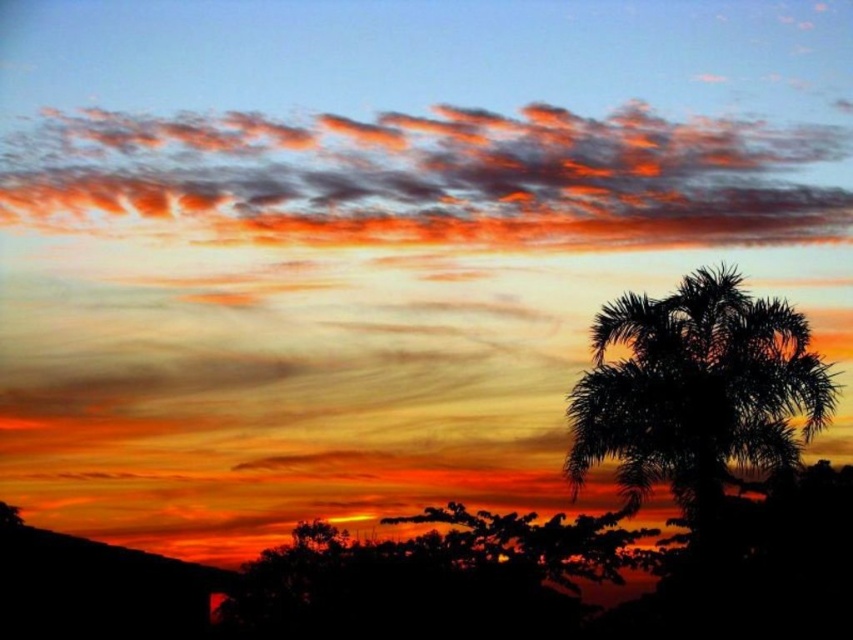
Question: Can you confirm if glowing orange clouds at upper center is positioned to the left of silhouette palm tree at right?

Choices:
 (A) yes
 (B) no

Answer: (A)

Question: Can you confirm if glowing orange clouds at upper center is bigger than silhouette palm tree at right?

Choices:
 (A) no
 (B) yes

Answer: (A)

Question: In this image, where is glowing orange clouds at upper center located relative to silhouette palm tree at right?

Choices:
 (A) left
 (B) right

Answer: (A)

Question: Among these objects, which one is nearest to the camera?

Choices:
 (A) silhouette palm tree at right
 (B) glowing orange clouds at upper center

Answer: (A)